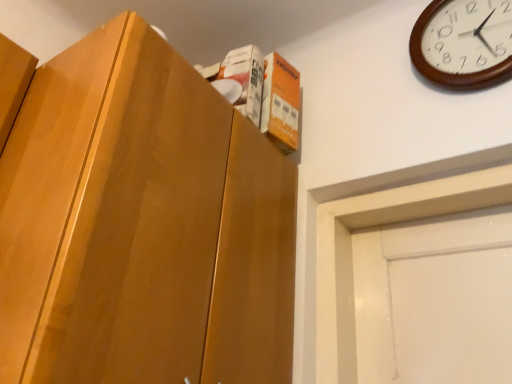
This screenshot has width=512, height=384. What are the coordinates of `matte wood cabinet at upper left` in the screenshot? It's located at (142, 225).

What do you see at coordinates (142, 225) in the screenshot? I see `matte wood cabinet at upper left` at bounding box center [142, 225].

What do you see at coordinates (462, 44) in the screenshot? I see `wooden clock at upper right` at bounding box center [462, 44].

Locate an element on the screen. The image size is (512, 384). wooden clock at upper right is located at coordinates (462, 44).

Where is `matte wood cabinet at upper left`? The width and height of the screenshot is (512, 384). matte wood cabinet at upper left is located at coordinates (142, 225).

Considering the relative positions of matte wood cabinet at upper left and wooden clock at upper right in the image provided, is matte wood cabinet at upper left to the left of wooden clock at upper right from the viewer's perspective?

Correct, you'll find matte wood cabinet at upper left to the left of wooden clock at upper right.

Looking at this image, who is more distant, matte wood cabinet at upper left or wooden clock at upper right?

wooden clock at upper right.

Is point (178, 136) positioned after point (413, 35)?

No, it is in front of (413, 35).

From the image's perspective, does matte wood cabinet at upper left appear higher than wooden clock at upper right?

No, from the image's perspective, matte wood cabinet at upper left is not over wooden clock at upper right.

From a real-world perspective, is matte wood cabinet at upper left physically below wooden clock at upper right?

Yes, from a real-world perspective, matte wood cabinet at upper left is below wooden clock at upper right.

Can you confirm if matte wood cabinet at upper left is wider than wooden clock at upper right?

Indeed, matte wood cabinet at upper left has a greater width compared to wooden clock at upper right.

In terms of height, does matte wood cabinet at upper left look taller or shorter compared to wooden clock at upper right?

Clearly, matte wood cabinet at upper left is taller compared to wooden clock at upper right.

Which of these two, matte wood cabinet at upper left or wooden clock at upper right, is bigger?

matte wood cabinet at upper left.

Is matte wood cabinet at upper left not within wooden clock at upper right?

Yes, matte wood cabinet at upper left is not within wooden clock at upper right.

Would you consider matte wood cabinet at upper left to be distant from wooden clock at upper right?

That's not correct — matte wood cabinet at upper left is a little close to wooden clock at upper right.

Could you tell me if matte wood cabinet at upper left is turned towards wooden clock at upper right?

No, matte wood cabinet at upper left is not aimed at wooden clock at upper right.

Measure the distance from matte wood cabinet at upper left to wooden clock at upper right.

matte wood cabinet at upper left is 66.87 centimeters away from wooden clock at upper right.

This screenshot has height=384, width=512. I want to click on cabinetry below the wooden clock at upper right (from a real-world perspective), so click(x=142, y=225).

Which is more to the left, wooden clock at upper right or matte wood cabinet at upper left?

Positioned to the left is matte wood cabinet at upper left.

Is the depth of wooden clock at upper right greater than that of matte wood cabinet at upper left?

Yes, wooden clock at upper right is further from the viewer.

Between point (490, 55) and point (282, 230), which one is positioned in front?

The point (490, 55) is closer to the camera.

From the image's perspective, is wooden clock at upper right above matte wood cabinet at upper left?

Yes, from the image's perspective, wooden clock at upper right is on top of matte wood cabinet at upper left.

From a real-world perspective, is wooden clock at upper right physically located above or below matte wood cabinet at upper left?

Clearly, from a real-world perspective, wooden clock at upper right is above matte wood cabinet at upper left.

Between wooden clock at upper right and matte wood cabinet at upper left, which one has smaller width?

wooden clock at upper right.

Considering the sizes of objects wooden clock at upper right and matte wood cabinet at upper left in the image provided, who is shorter, wooden clock at upper right or matte wood cabinet at upper left?

Standing shorter between the two is wooden clock at upper right.

Can you confirm if wooden clock at upper right is bigger than matte wood cabinet at upper left?

Incorrect, wooden clock at upper right is not larger than matte wood cabinet at upper left.

Is matte wood cabinet at upper left completely or partially inside wooden clock at upper right?

No, wooden clock at upper right does not contain matte wood cabinet at upper left.

Is wooden clock at upper right in contact with matte wood cabinet at upper left?

They are not placed beside each other.

Is wooden clock at upper right facing towards matte wood cabinet at upper left?

No, wooden clock at upper right is not oriented towards matte wood cabinet at upper left.

Can you tell me how much wooden clock at upper right and matte wood cabinet at upper left differ in facing direction?

The facing directions of wooden clock at upper right and matte wood cabinet at upper left are 90 degrees apart.

At what (x,y) coordinates should I click in order to perform the action: click on wall clock that is above the matte wood cabinet at upper left (from the image's perspective). Please return your answer as a coordinate pair (x, y). The height and width of the screenshot is (384, 512). Looking at the image, I should click on (462, 44).

Identify the location of wall clock on the right of matte wood cabinet at upper left. The image size is (512, 384). (462, 44).

The image size is (512, 384). I want to click on wall clock that appears behind the matte wood cabinet at upper left, so click(462, 44).